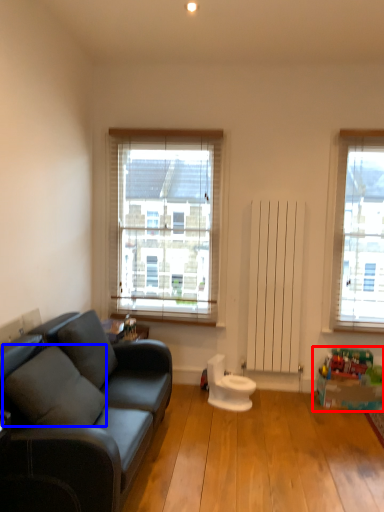
Question: Among these objects, which one is farthest to the camera, toy (highlighted by a red box) or pillow (highlighted by a blue box)?

Choices:
 (A) toy
 (B) pillow

Answer: (A)